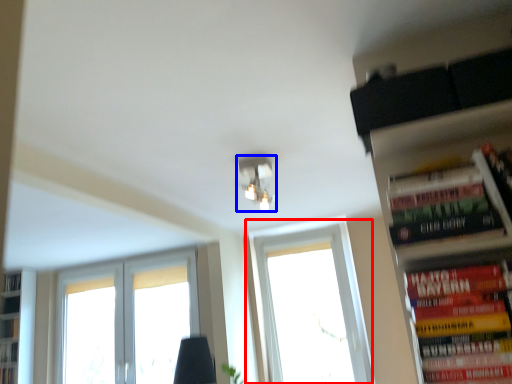
Question: Which of the following is the closest to the observer, window (highlighted by a red box) or light fixture (highlighted by a blue box)?

Choices:
 (A) window
 (B) light fixture

Answer: (B)